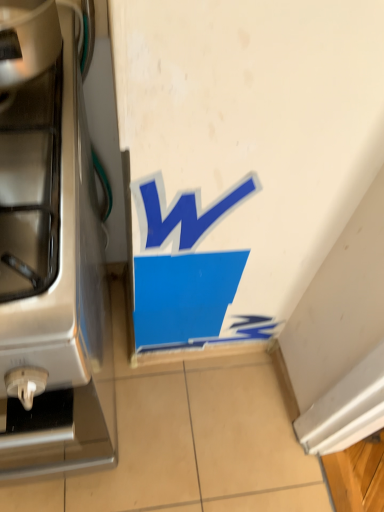
What do you see at coordinates (50, 255) in the screenshot? I see `stainless steel stove at left` at bounding box center [50, 255].

In order to face stainless steel stove at left, should I rotate leftwards or rightwards?

To align with it, rotate left about 20.276°.

You are a GUI agent. You are given a task and a screenshot of the screen. Output one action in this format:
    pyautogui.click(x=<x>, y=<y>)
    Task: Click on the stainless steel stove at left
    The image size is (384, 512).
    Given the screenshot: What is the action you would take?
    pyautogui.click(x=50, y=255)

You are a GUI agent. You are given a task and a screenshot of the screen. Output one action in this format:
    pyautogui.click(x=<x>, y=<y>)
    Task: Click on the stainless steel stove at left
    
    Given the screenshot: What is the action you would take?
    pyautogui.click(x=50, y=255)